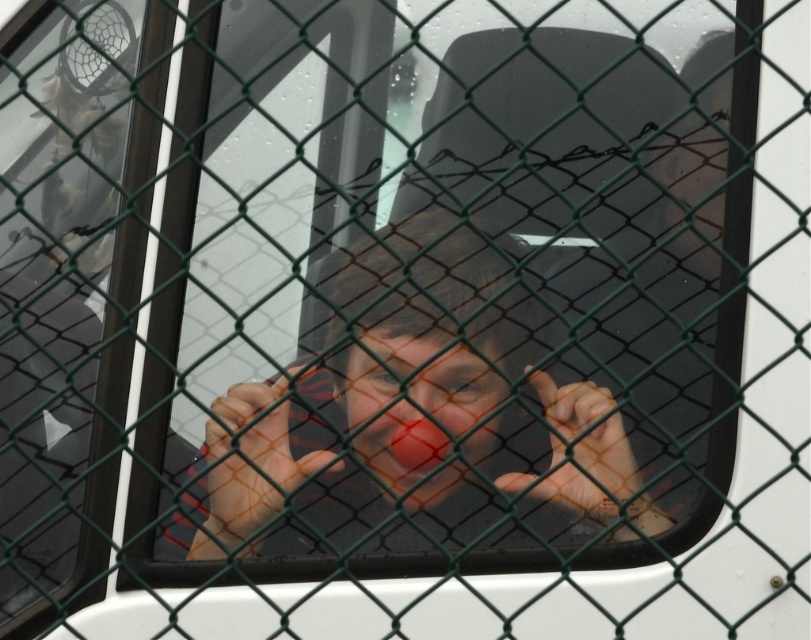
Can you confirm if matte red clown nose at center is positioned to the left of red matte clown nose at center?

No, matte red clown nose at center is not to the left of red matte clown nose at center.

Image resolution: width=811 pixels, height=640 pixels. Describe the element at coordinates (417, 417) in the screenshot. I see `matte red clown nose at center` at that location.

The height and width of the screenshot is (640, 811). What are the coordinates of `matte red clown nose at center` in the screenshot? It's located at click(417, 417).